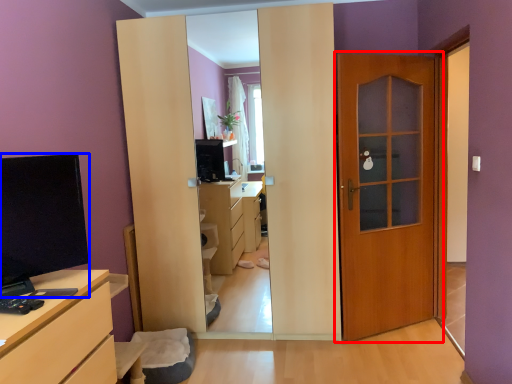
Question: Which object appears farthest to the camera in this image, door (highlighted by a red box) or open (highlighted by a blue box)?

Choices:
 (A) door
 (B) open

Answer: (A)